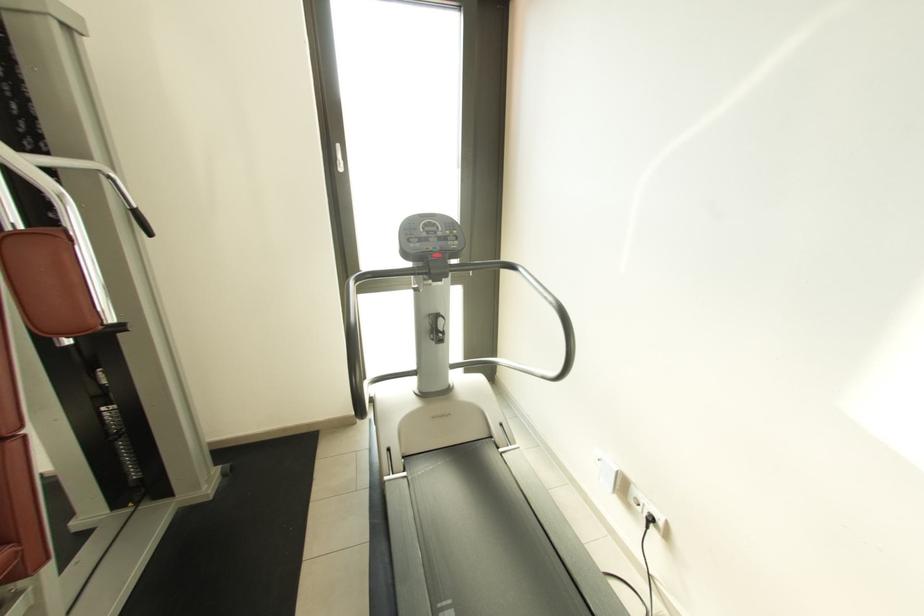
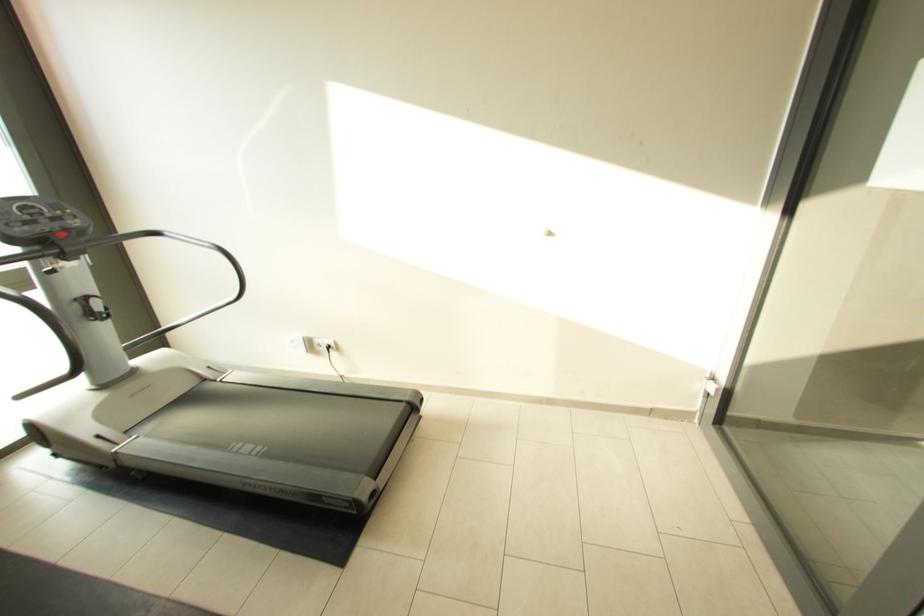
Where in the second image is the point corresponding to point (554, 305) from the first image?

(214, 249)